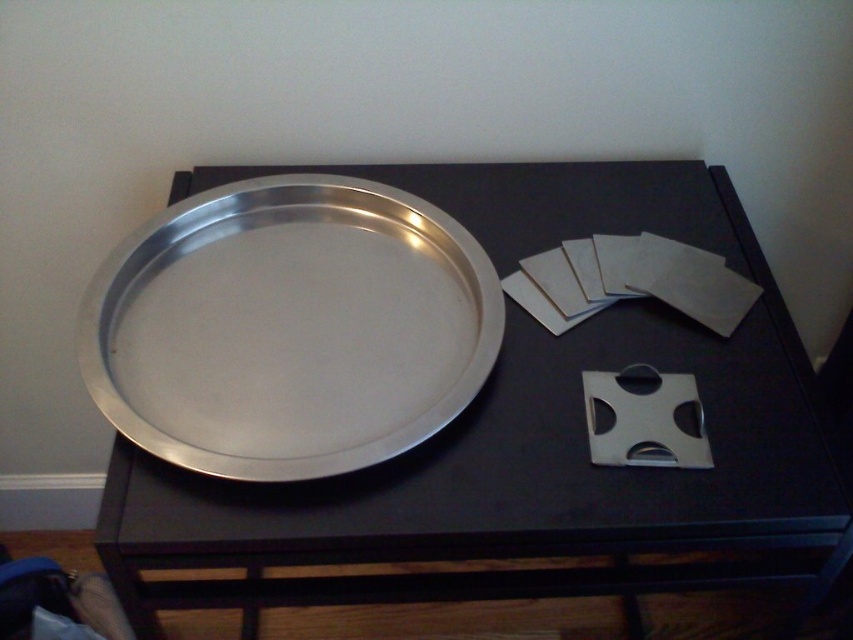
You are organizing a small party and need to place a vase between the metallic silver tray at center and the silver metallic tray at center. Which tray should the vase be placed to the left of?

The vase should be placed to the left of the silver metallic tray at center because the metallic silver tray at center is positioned on the right side of it.

You are standing in front of the dark wooden surface and want to place a small ornament exactly at the point labeled as point (527, 436). Which object is located at that coordinate?

The point (527, 436) corresponds to the metallic silver tray at center.